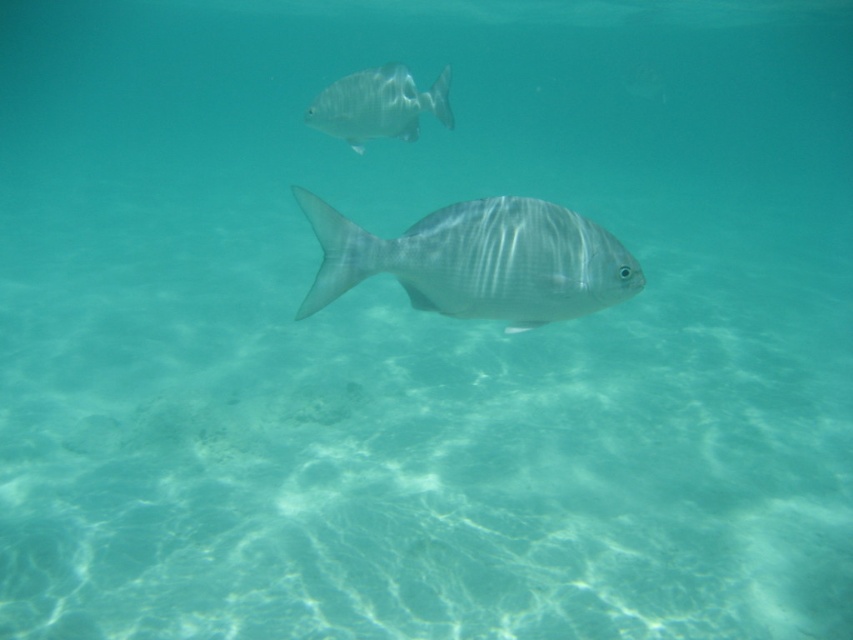
You are a marine biologist observing underwater. You notice two fish in the scene. Which fish is positioned closer to you, the shiny silver fish at center or the silvery metallic fish at upper center?

The shiny silver fish at center is closer to the viewer than the silvery metallic fish at upper center.

From the picture: You are a marine biologist observing two fish in an underwater scene. You notice a shiny silver fish at center and a silvery metallic fish at upper center. Which fish is positioned lower in the water? Please refer to their exact labels as given.

The shiny silver fish at center is positioned lower in the water than the silvery metallic fish at upper center according to their exact labels.

You are a marine biologist observing two fish in an underwater scene. You notice the shiny silver fish at center and the silvery metallic fish at upper center. Which fish has a smaller height?

The shiny silver fish at center has a lesser height compared to the silvery metallic fish at upper center, so the shiny silver fish at center is smaller in height.